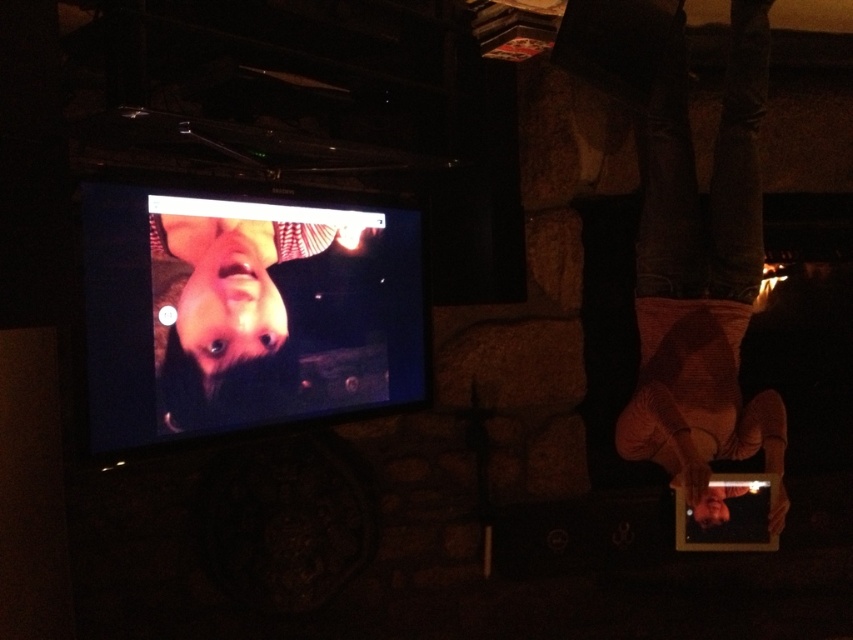
Question: Does striped sweater at lower right come in front of smooth skin face at upper left?

Choices:
 (A) no
 (B) yes

Answer: (A)

Question: Does striped sweater at lower right have a larger size compared to smooth skin face at upper left?

Choices:
 (A) yes
 (B) no

Answer: (A)

Question: Which of the following is the closest to the observer?

Choices:
 (A) (264, 368)
 (B) (785, 445)

Answer: (A)

Question: Which point appears closest to the camera in this image?

Choices:
 (A) (665, 188)
 (B) (212, 220)

Answer: (B)

Question: Is striped sweater at lower right wider than smooth skin face at upper left?

Choices:
 (A) yes
 (B) no

Answer: (B)

Question: Which point is farther from the camera taking this photo?

Choices:
 (A) (691, 330)
 (B) (372, 227)

Answer: (A)